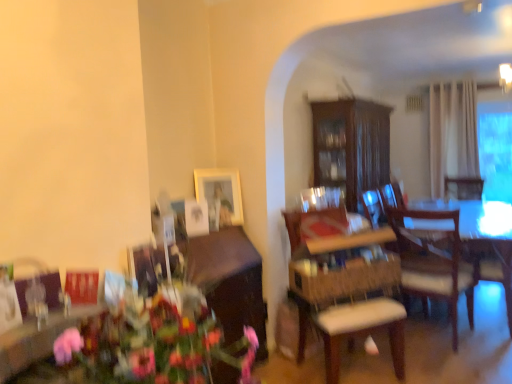
Question: In terms of size, does wooden chair at center, placed as the first chair when sorted from top to bottom, appear bigger or smaller than transparent glass window at right?

Choices:
 (A) small
 (B) big

Answer: (A)

Question: In terms of height, does wooden chair at center, which appears as the second chair when ordered from the bottom, look taller or shorter compared to transparent glass window at right?

Choices:
 (A) short
 (B) tall

Answer: (A)

Question: Estimate the real-world distances between objects in this image. Which object is closer to the dark wood cabinet at center, the second cabinetry positioned from the front?

Choices:
 (A) wooden chair with white cushion at right, which ranks as the 2th chair in top-to-bottom order
 (B) wooden chair at center, placed as the first chair when sorted from top to bottom
 (C) wooden armchair at right
 (D) wooden cabinet at lower left, the 2th cabinetry in the right-to-left sequence
 (E) matte wooden picture frame at upper center

Answer: (B)

Question: Which is nearer to the matte wooden picture frame at upper center?

Choices:
 (A) wooden chair at center, placed as the first chair when sorted from top to bottom
 (B) dark wood cabinet at center, which is counted as the first cabinetry, starting from the top
 (C) wooden chair with white cushion at right, which ranks as the 2th chair in top-to-bottom order
 (D) wooden cabinet at lower left, which appears as the second cabinetry when viewed from the back
 (E) wooden armchair at right

Answer: (D)